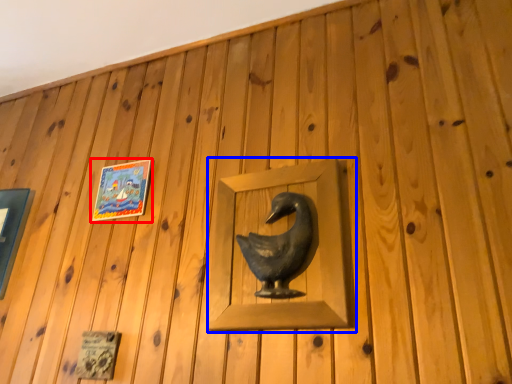
Question: Which point is further to the camera, picture frame (highlighted by a red box) or sculpture (highlighted by a blue box)?

Choices:
 (A) picture frame
 (B) sculpture

Answer: (A)